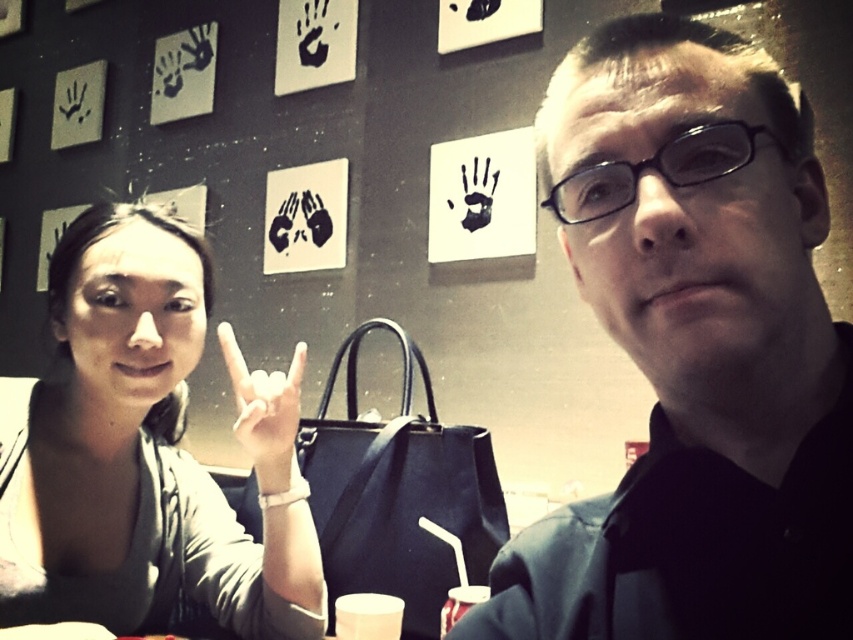
You are organizing a clothing display and need to arrange the black matte shirt at center and the matte gray shirt at left based on their thickness. Which shirt should you place first if you want to arrange them from thinnest to thickest?

The black matte shirt at center is thinner than the matte gray shirt at left, so you should place the black matte shirt at center first when arranging from thinnest to thickest.

You are a photographer setting up for a group photo. You want to ensure that both the matte gray shirt at left and the translucent plastic cup at lower center are clearly visible in the shot. Given their current positions, which object should you adjust to avoid obstruction?

The translucent plastic cup at lower center is behind the matte gray shirt at left, so you should adjust the translucent plastic cup at lower center to move it forward so it is not blocked by the shirt.